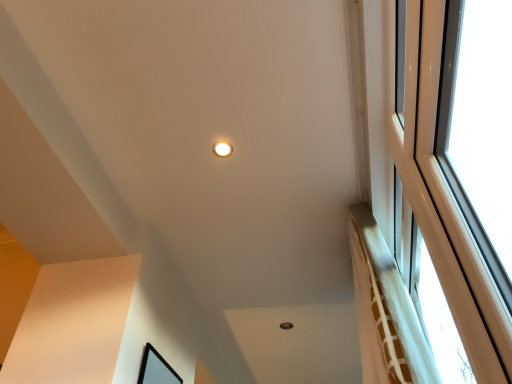
Describe the element at coordinates (222, 149) in the screenshot. I see `matte white light fixture at upper center` at that location.

At what (x,y) coordinates should I click in order to perform the action: click on matte white light fixture at upper center. Please return your answer as a coordinate pair (x, y). Image resolution: width=512 pixels, height=384 pixels. Looking at the image, I should click on (222, 149).

What do you see at coordinates (156, 369) in the screenshot? I see `black matte picture frame at lower left` at bounding box center [156, 369].

Locate an element on the screen. black matte picture frame at lower left is located at coordinates (156, 369).

Consider the image. Measure the distance between black matte picture frame at lower left and camera.

The depth of black matte picture frame at lower left is 1.64 meters.

Locate an element on the screen. The image size is (512, 384). matte white light fixture at upper center is located at coordinates (222, 149).

Is matte white light fixture at upper center at the right side of black matte picture frame at lower left?

Yes.

Which object is closer to the camera, matte white light fixture at upper center or black matte picture frame at lower left?

black matte picture frame at lower left is more forward.

Considering the points (218, 150) and (163, 378), which point is behind, point (218, 150) or point (163, 378)?

The point (163, 378) is farther from the camera.

From the image's perspective, is matte white light fixture at upper center positioned above or below black matte picture frame at lower left?

matte white light fixture at upper center is above black matte picture frame at lower left.

From a real-world perspective, is matte white light fixture at upper center under black matte picture frame at lower left?

Incorrect, from a real-world perspective, matte white light fixture at upper center is higher than black matte picture frame at lower left.

Can you confirm if matte white light fixture at upper center is thinner than black matte picture frame at lower left?

Incorrect, the width of matte white light fixture at upper center is not less than that of black matte picture frame at lower left.

Is matte white light fixture at upper center taller or shorter than black matte picture frame at lower left?

Considering their sizes, matte white light fixture at upper center has less height than black matte picture frame at lower left.

Considering the sizes of objects matte white light fixture at upper center and black matte picture frame at lower left in the image provided, who is smaller, matte white light fixture at upper center or black matte picture frame at lower left?

matte white light fixture at upper center.

Is matte white light fixture at upper center surrounding black matte picture frame at lower left?

Definitely not — black matte picture frame at lower left is not inside matte white light fixture at upper center.

Are matte white light fixture at upper center and black matte picture frame at lower left beside each other?

No, matte white light fixture at upper center is not making contact with black matte picture frame at lower left.

Is matte white light fixture at upper center oriented away from black matte picture frame at lower left?

No.

How much distance is there between matte white light fixture at upper center and black matte picture frame at lower left?

36.71 inches.

You are a GUI agent. You are given a task and a screenshot of the screen. Output one action in this format:
    pyautogui.click(x=<x>, y=<y>)
    Task: Click on the lighting on the right side of black matte picture frame at lower left
    
    Given the screenshot: What is the action you would take?
    pyautogui.click(x=222, y=149)

Considering the relative positions of black matte picture frame at lower left and matte white light fixture at upper center in the image provided, is black matte picture frame at lower left to the left of matte white light fixture at upper center from the viewer's perspective?

Correct, you'll find black matte picture frame at lower left to the left of matte white light fixture at upper center.

Considering the relative positions of black matte picture frame at lower left and matte white light fixture at upper center in the image provided, is black matte picture frame at lower left behind matte white light fixture at upper center?

No, black matte picture frame at lower left is in front of matte white light fixture at upper center.

Is point (145, 354) positioned before point (231, 149)?

No, (145, 354) is behind (231, 149).

Consider the image. From the image's perspective, between black matte picture frame at lower left and matte white light fixture at upper center, which one is located above?

matte white light fixture at upper center appears higher in the image.

From a real-world perspective, is black matte picture frame at lower left physically located above or below matte white light fixture at upper center?

Clearly, from a real-world perspective, black matte picture frame at lower left is below matte white light fixture at upper center.

Looking at their sizes, would you say black matte picture frame at lower left is wider or thinner than matte white light fixture at upper center?

In the image, black matte picture frame at lower left appears to be more narrow than matte white light fixture at upper center.

From the picture: Can you confirm if black matte picture frame at lower left is shorter than matte white light fixture at upper center?

Incorrect, the height of black matte picture frame at lower left does not fall short of that of matte white light fixture at upper center.

Based on their sizes in the image, would you say black matte picture frame at lower left is bigger or smaller than matte white light fixture at upper center?

black matte picture frame at lower left is bigger than matte white light fixture at upper center.

Is matte white light fixture at upper center completely or partially inside black matte picture frame at lower left?

Actually, matte white light fixture at upper center is outside black matte picture frame at lower left.

Is black matte picture frame at lower left beside matte white light fixture at upper center?

A: black matte picture frame at lower left and matte white light fixture at upper center are clearly separated.

Is black matte picture frame at lower left turned away from matte white light fixture at upper center?

black matte picture frame at lower left does not have its back to matte white light fixture at upper center.

How many degrees apart are the facing directions of black matte picture frame at lower left and matte white light fixture at upper center?

They differ by 179 degrees in their facing directions.

Measure the distance from black matte picture frame at lower left to matte white light fixture at upper center.

black matte picture frame at lower left is 36.71 inches from matte white light fixture at upper center.

The height and width of the screenshot is (384, 512). In order to click on lighting that appears behind the black matte picture frame at lower left in this screenshot , I will do `click(222, 149)`.

In the image, there is a black matte picture frame at lower left. At what (x,y) coordinates should I click in order to perform the action: click on lighting above it (from the image's perspective). Please return your answer as a coordinate pair (x, y). This screenshot has height=384, width=512. Looking at the image, I should click on (222, 149).

The height and width of the screenshot is (384, 512). Find the location of `lighting behind the black matte picture frame at lower left`. lighting behind the black matte picture frame at lower left is located at coordinates (222, 149).